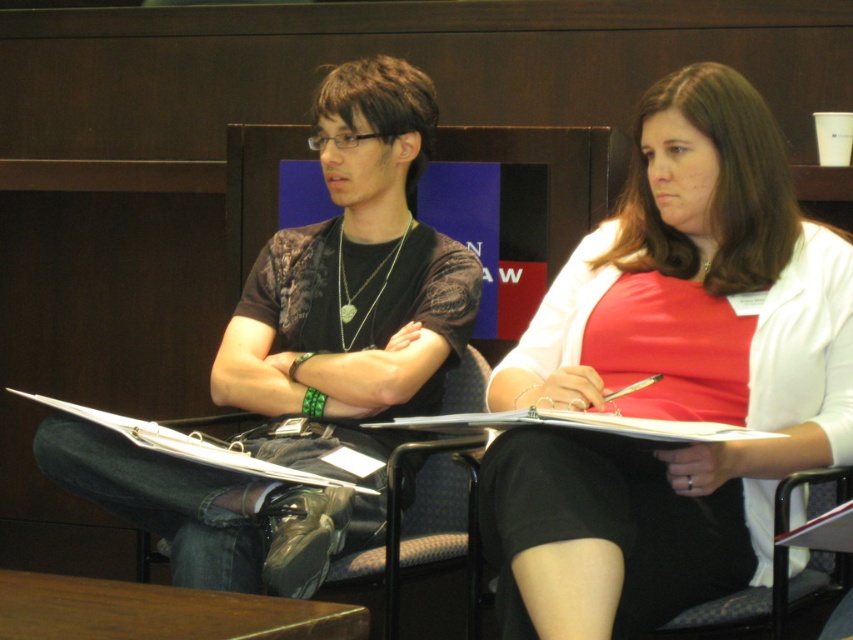
Question: Is black leather chair at center to the left of fabric covered chair at lower right from the viewer's perspective?

Choices:
 (A) no
 (B) yes

Answer: (B)

Question: Which point is closer to the camera?

Choices:
 (A) [x=316, y=442]
 (B) [x=215, y=596]

Answer: (B)

Question: Can you confirm if brown wood table at lower left is thinner than metallic silver clipboard at center?

Choices:
 (A) yes
 (B) no

Answer: (A)

Question: Which of the following is the farthest from the observer?

Choices:
 (A) (447, 368)
 (B) (225, 465)
 (C) (351, 634)
 (D) (775, 353)

Answer: (A)

Question: Where is black matte shirt at center located in relation to brown wood table at lower left in the image?

Choices:
 (A) above
 (B) below

Answer: (A)

Question: Which point is closer to the camera taking this photo?

Choices:
 (A) (299, 560)
 (B) (85, 412)

Answer: (A)